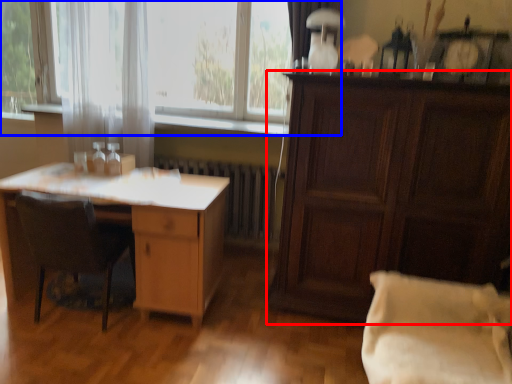
Question: Which object is further to the camera taking this photo, cabinetry (highlighted by a red box) or window (highlighted by a blue box)?

Choices:
 (A) cabinetry
 (B) window

Answer: (B)